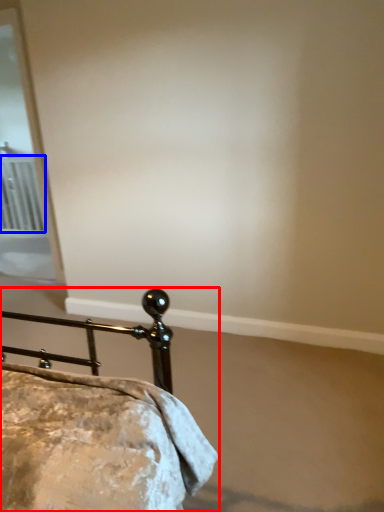
Question: Which object is further to the camera taking this photo, bed (highlighted by a red box) or radiator (highlighted by a blue box)?

Choices:
 (A) bed
 (B) radiator

Answer: (B)